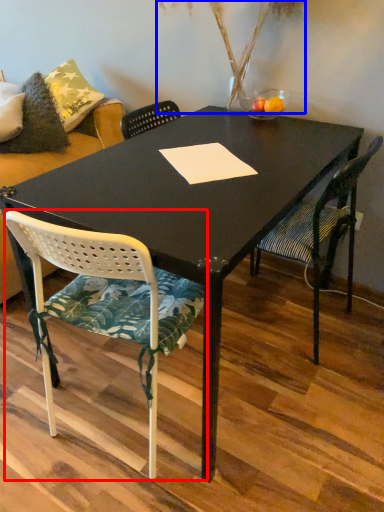
Question: Which object appears farthest to the camera in this image, chair (highlighted by a red box) or plant (highlighted by a blue box)?

Choices:
 (A) chair
 (B) plant

Answer: (B)